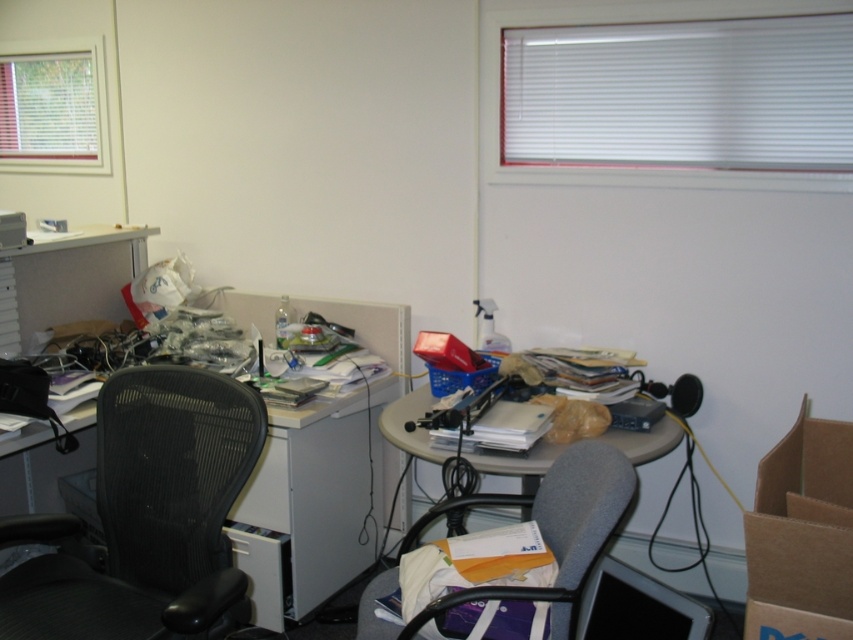
Question: Based on their relative distances, which object is farther from the matte plastic table at center?

Choices:
 (A) brown cardboard box at lower right
 (B) black plastic monitor at lower center

Answer: (A)

Question: Which point is farther to the camera?

Choices:
 (A) black plastic monitor at lower center
 (B) matte plastic table at center
 (C) brown cardboard box at lower right

Answer: (B)

Question: Which point is closer to the camera taking this photo?

Choices:
 (A) (560, 449)
 (B) (824, 493)
 (C) (682, 618)
 (D) (368, 304)

Answer: (C)

Question: Does white plastic computer desk at left lie in front of matte plastic table at center?

Choices:
 (A) yes
 (B) no

Answer: (B)

Question: Can you confirm if brown cardboard box at lower right is positioned above gray fabric chair at lower center?

Choices:
 (A) no
 (B) yes

Answer: (B)

Question: Where is white plastic computer desk at left located in relation to brown cardboard box at lower right in the image?

Choices:
 (A) below
 (B) above

Answer: (A)